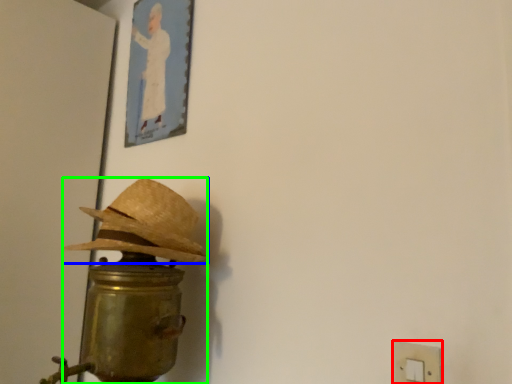
Question: Estimate the real-world distances between objects in this image. Which object is farther from light switch (highlighted by a red box), hat (highlighted by a blue box) or table lamp (highlighted by a green box)?

Choices:
 (A) hat
 (B) table lamp

Answer: (A)